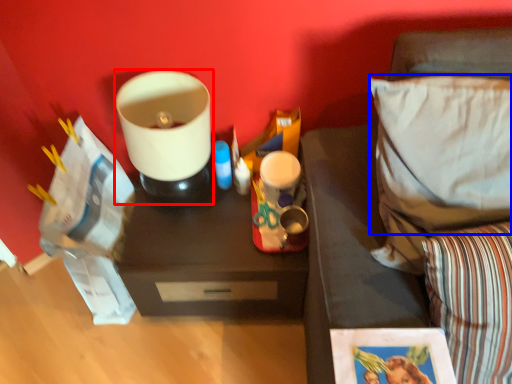
Question: Among these objects, which one is nearest to the camera, appliance (highlighted by a red box) or pillow (highlighted by a blue box)?

Choices:
 (A) appliance
 (B) pillow

Answer: (B)